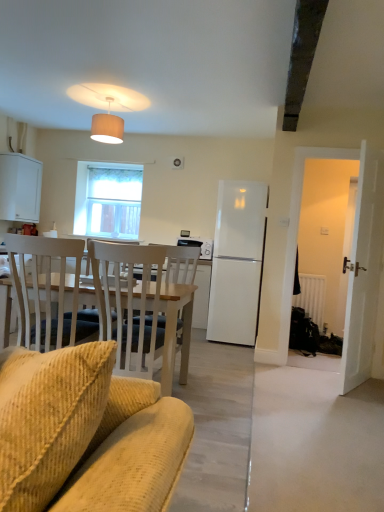
What do you see at coordinates (108, 200) in the screenshot?
I see `translucent fabric at upper left` at bounding box center [108, 200].

This screenshot has height=512, width=384. Find the location of `dark gray metallic exhaust hood at upper right`. dark gray metallic exhaust hood at upper right is located at coordinates click(302, 56).

What do you see at coordinates (312, 297) in the screenshot? I see `white matte radiator at right` at bounding box center [312, 297].

What do you see at coordinates (107, 127) in the screenshot?
I see `beige ribbed lampshade at upper center` at bounding box center [107, 127].

Where is `beige ribbed lampshade at upper center`? beige ribbed lampshade at upper center is located at coordinates (107, 127).

Describe the element at coordinates (20, 188) in the screenshot. This screenshot has width=384, height=512. I see `white matte cabinet at left` at that location.

Identify the location of translucent fabric at upper left. (108, 200).

From the image's perspective, would you say white matte cabinet at left is positioned over white matte refrigerator at center?

Yes, from the image's perspective, white matte cabinet at left is above white matte refrigerator at center.

In the scene shown: Is white matte cabinet at left facing away from white matte refrigerator at center?

white matte cabinet at left does not have its back to white matte refrigerator at center.

Which object is more forward, white matte cabinet at left or white matte refrigerator at center?

white matte refrigerator at center.

You are a GUI agent. You are given a task and a screenshot of the screen. Output one action in this format:
    pyautogui.click(x=<x>, y=<y>)
    Task: Click on the microwave oven located on the left of white matte radiator at right
    The width and height of the screenshot is (384, 512).
    Given the screenshot: What is the action you would take?
    pyautogui.click(x=198, y=246)

Is satin black microwave at center taller than white matte radiator at right?

No.

Is satin black microwave at center oriented away from white matte radiator at right?

No, satin black microwave at center is not facing the opposite direction of white matte radiator at right.

From the image's perspective, is satin black microwave at center above white matte radiator at right?

Yes, from the image's perspective, satin black microwave at center is on top of white matte radiator at right.

From the image's perspective, which is below, white matte cabinet at left or translucent fabric at upper left?

translucent fabric at upper left appears lower in the image.

Which of these two, white matte cabinet at left or translucent fabric at upper left, is thinner?

translucent fabric at upper left.

In the image, is white matte cabinet at left positioned in front of or behind translucent fabric at upper left?

In the image, white matte cabinet at left appears in front of translucent fabric at upper left.

Is white matte cabinet at left at the right side of translucent fabric at upper left?

Incorrect, white matte cabinet at left is not on the right side of translucent fabric at upper left.

Is the surface of white matte radiator at right in direct contact with wooden chair at left?

white matte radiator at right is not next to wooden chair at left, and they're not touching.

Who is taller, white matte radiator at right or wooden chair at left?

Standing taller between the two is wooden chair at left.

Is white matte radiator at right inside the boundaries of wooden chair at left, or outside?

white matte radiator at right is located beyond the bounds of wooden chair at left.

Who is more distant, white matte radiator at right or wooden chair at left?

white matte radiator at right is further away from the camera.

Is translucent fabric at upper left at the back of wooden chair at left?

No.

Considering the sizes of objects wooden chair at left and translucent fabric at upper left in the image provided, who is shorter, wooden chair at left or translucent fabric at upper left?

With less height is wooden chair at left.

Which object is thinner, wooden chair at left or translucent fabric at upper left?

translucent fabric at upper left is thinner.

Does wooden chair at left have a greater height compared to dark gray metallic exhaust hood at upper right?

Yes.

Which object is thinner, wooden chair at left or dark gray metallic exhaust hood at upper right?

With smaller width is wooden chair at left.

Does wooden chair at left appear on the left side of dark gray metallic exhaust hood at upper right?

Correct, you'll find wooden chair at left to the left of dark gray metallic exhaust hood at upper right.

From a real-world perspective, does wooden chair at left sit lower than dark gray metallic exhaust hood at upper right?

Yes.

How many degrees apart are the facing directions of white matte cabinet at left and wooden chair at left?

The facing directions of white matte cabinet at left and wooden chair at left are 139 degrees apart.

Is white matte cabinet at left turned away from wooden chair at left?

No.

Which is closer, (14, 195) or (39, 418)?

The point (39, 418) is in front.

Between white matte cabinet at left and wooden chair at left, which one has more height?

wooden chair at left is taller.

Find the location of a particular element. This screenshot has height=512, width=384. refrigerator lying on the right of white matte cabinet at left is located at coordinates (237, 262).

There is a white matte radiator at right. In order to click on microwave oven above it (from a real-world perspective) in this screenshot , I will do `click(198, 246)`.

Estimate the real-world distances between objects in this image. Which object is further from translucent fabric at upper left, white matte refrigerator at center or wooden chair at left?

wooden chair at left.

When comparing their distances from white matte cabinet at left, does dark gray metallic exhaust hood at upper right or wooden chair at left seem further?

Based on the image, wooden chair at left appears to be further to white matte cabinet at left.

Looking at the image, which one is located further to wooden chair at left, white matte radiator at right or translucent fabric at upper left?

translucent fabric at upper left.

Considering their positions, is translucent fabric at upper left positioned further to beige ribbed lampshade at upper center than white matte radiator at right?

white matte radiator at right lies further to beige ribbed lampshade at upper center than the other object.

Based on their spatial positions, is wooden chair at left or beige ribbed lampshade at upper center further from white matte refrigerator at center?

wooden chair at left is further to white matte refrigerator at center.

When comparing their distances from satin black microwave at center, does white matte radiator at right or translucent fabric at upper left seem closer?

The object closer to satin black microwave at center is white matte radiator at right.

Which object lies further to the anchor point translucent fabric at upper left, dark gray metallic exhaust hood at upper right or beige ribbed lampshade at upper center?

dark gray metallic exhaust hood at upper right is positioned further to the anchor translucent fabric at upper left.

Which object lies further to the anchor point dark gray metallic exhaust hood at upper right, white matte radiator at right or white matte cabinet at left?

white matte cabinet at left lies further to dark gray metallic exhaust hood at upper right than the other object.

Find the location of `refrigerator between wooden chair at left and white matte radiator at right from front to back`. refrigerator between wooden chair at left and white matte radiator at right from front to back is located at coordinates (237, 262).

What are the coordinates of `microwave oven between wooden chair at left and white matte cabinet at left from front to back` in the screenshot? It's located at (198, 246).

Find the location of a particular element. This screenshot has width=384, height=512. lamp between dark gray metallic exhaust hood at upper right and translucent fabric at upper left in the front-back direction is located at coordinates (107, 127).

Where is `lamp located between wooden chair at left and white matte radiator at right in the depth direction`? The height and width of the screenshot is (512, 384). lamp located between wooden chair at left and white matte radiator at right in the depth direction is located at coordinates (107, 127).